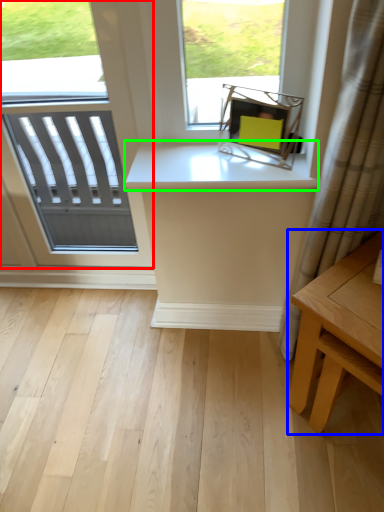
Question: Based on their relative distances, which object is nearer to window (highlighted by a red box)? Choose from table (highlighted by a blue box) and counter top (highlighted by a green box).

Choices:
 (A) table
 (B) counter top

Answer: (B)